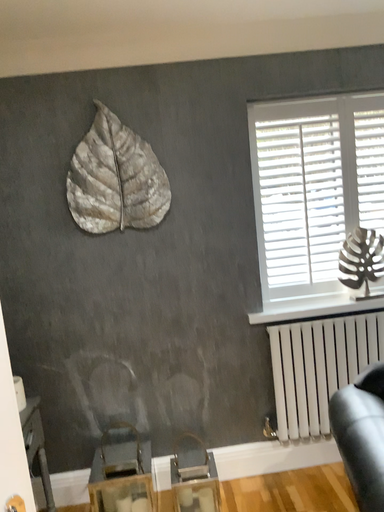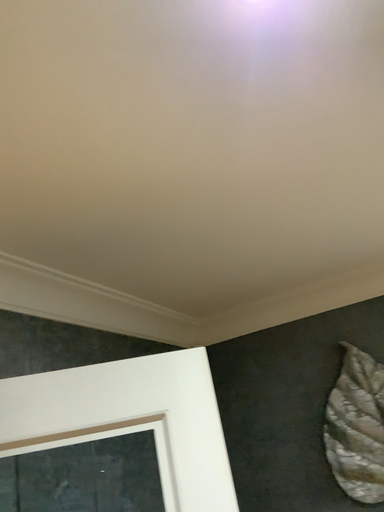
Question: Which way did the camera rotate in the video?

Choices:
 (A) rotated left
 (B) rotated right

Answer: (A)